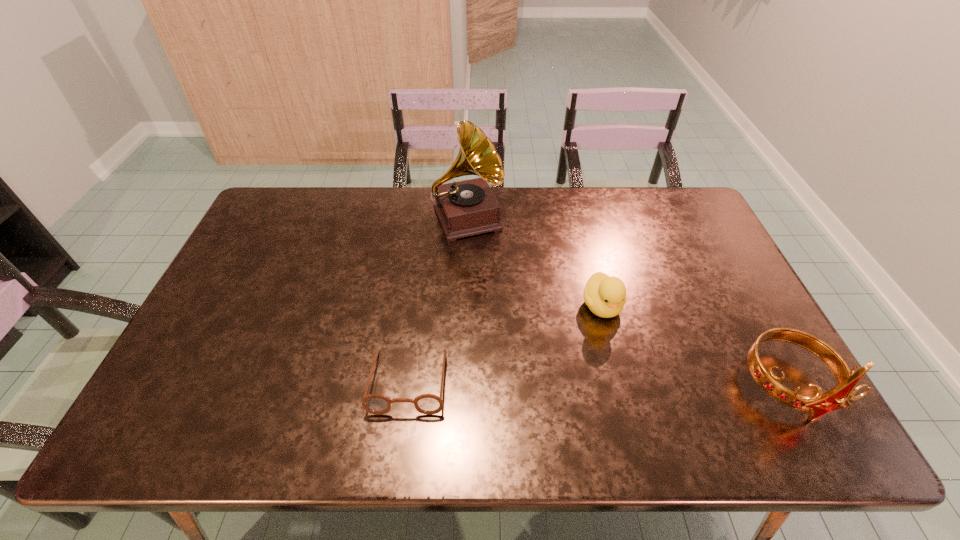
Locate an element on the screen. This screenshot has height=540, width=960. the shortest object is located at coordinates (429, 404).

The height and width of the screenshot is (540, 960). What are the coordinates of `tiara` in the screenshot? It's located at (819, 404).

Identify the location of the rightmost object. This screenshot has height=540, width=960. (819, 404).

This screenshot has height=540, width=960. Identify the location of phonograph record. (464, 208).

The width and height of the screenshot is (960, 540). Identify the location of the tallest object. (464, 208).

Image resolution: width=960 pixels, height=540 pixels. What are the coordinates of `the second object from right to left` in the screenshot? It's located at (605, 296).

The height and width of the screenshot is (540, 960). In order to click on the second farthest object in this screenshot , I will do `click(605, 296)`.

Locate an element on the screen. The height and width of the screenshot is (540, 960). free region located from the horn of the farthest object is located at coordinates (505, 305).

Locate an element on the screen. The width and height of the screenshot is (960, 540). vacant space located from the horn of the farthest object is located at coordinates (494, 282).

This screenshot has height=540, width=960. What are the coordinates of `free region located 0.220m from the horn of the farthest object` in the screenshot? It's located at (501, 297).